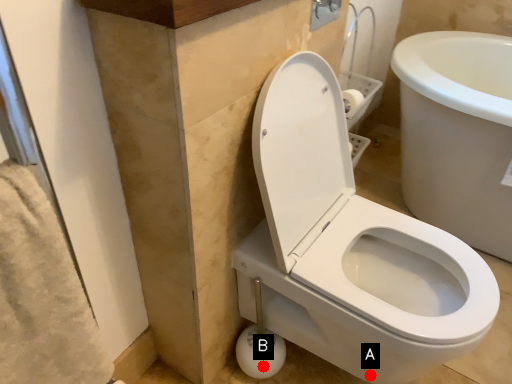
Question: Two points are circled on the image, labeled by A and B beside each circle. Which point is closer to the camera?

Choices:
 (A) A is closer
 (B) B is closer

Answer: (A)